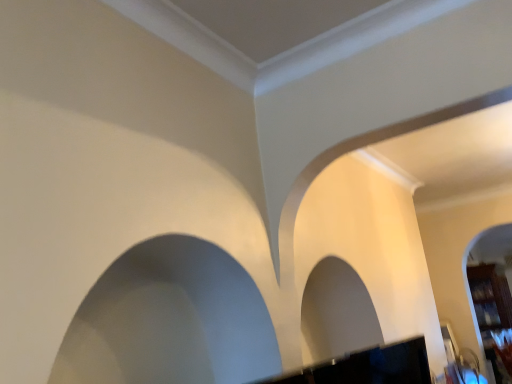
Locate an element on the screen. The height and width of the screenshot is (384, 512). white smooth rock arch at left is located at coordinates (170, 320).

Describe the element at coordinates (170, 320) in the screenshot. I see `white smooth rock arch at left` at that location.

Locate an element on the screen. wooden bookshelf at right is located at coordinates (490, 307).

This screenshot has height=384, width=512. What do you see at coordinates (490, 307) in the screenshot?
I see `wooden bookshelf at right` at bounding box center [490, 307].

In order to click on white smooth rock arch at left in this screenshot , I will do `click(170, 320)`.

Does wooden bookshelf at right appear on the left side of white smooth rock arch at left?

Incorrect, wooden bookshelf at right is not on the left side of white smooth rock arch at left.

Which is behind, wooden bookshelf at right or white smooth rock arch at left?

wooden bookshelf at right is further from the camera.

Which point is more distant from viewer, (492,347) or (163,235)?

The point (492,347) is farther.

From the image's perspective, is wooden bookshelf at right on white smooth rock arch at left?

Incorrect, from the image's perspective, wooden bookshelf at right is lower than white smooth rock arch at left.

From a real-world perspective, who is located higher, wooden bookshelf at right or white smooth rock arch at left?

From a 3D spatial view, white smooth rock arch at left is above.

From the picture: Which of these two, wooden bookshelf at right or white smooth rock arch at left, is wider?

wooden bookshelf at right is wider.

Is wooden bookshelf at right taller than white smooth rock arch at left?

Yes.

Can you confirm if wooden bookshelf at right is smaller than white smooth rock arch at left?

Actually, wooden bookshelf at right might be larger than white smooth rock arch at left.

Would you say wooden bookshelf at right is outside white smooth rock arch at left?

wooden bookshelf at right is positioned outside white smooth rock arch at left.

Looking at this image, are wooden bookshelf at right and white smooth rock arch at left far apart?

Yes, wooden bookshelf at right is far from white smooth rock arch at left.

Could you tell me if wooden bookshelf at right is facing white smooth rock arch at left?

No, wooden bookshelf at right does not turn towards white smooth rock arch at left.

How many degrees apart are the facing directions of wooden bookshelf at right and white smooth rock arch at left?

There is a 4.17-degree angle between the facing directions of wooden bookshelf at right and white smooth rock arch at left.

Measure the distance between wooden bookshelf at right and white smooth rock arch at left.

13.60 feet.

The image size is (512, 384). Find the location of `rock arch in front of the wooden bookshelf at right`. rock arch in front of the wooden bookshelf at right is located at coordinates (170, 320).

From the picture: Is white smooth rock arch at left at the left side of wooden bookshelf at right?

Correct, you'll find white smooth rock arch at left to the left of wooden bookshelf at right.

Which object is further away from the camera taking this photo, white smooth rock arch at left or wooden bookshelf at right?

wooden bookshelf at right is behind.

Does point (163, 339) lie in front of point (486, 288)?

Yes.

From the image's perspective, is white smooth rock arch at left above wooden bookshelf at right?

Yes, from the image's perspective, white smooth rock arch at left is on top of wooden bookshelf at right.

From a real-world perspective, who is located higher, white smooth rock arch at left or wooden bookshelf at right?

From a 3D spatial view, white smooth rock arch at left is above.

Does white smooth rock arch at left have a greater width compared to wooden bookshelf at right?

No, white smooth rock arch at left is not wider than wooden bookshelf at right.

Is white smooth rock arch at left taller than wooden bookshelf at right?

No.

Can you confirm if white smooth rock arch at left is smaller than wooden bookshelf at right?

Yes, white smooth rock arch at left is smaller than wooden bookshelf at right.

Is white smooth rock arch at left not inside wooden bookshelf at right?

Yes.

Would you consider white smooth rock arch at left to be distant from wooden bookshelf at right?

Indeed, white smooth rock arch at left is not near wooden bookshelf at right.

Is white smooth rock arch at left looking in the opposite direction of wooden bookshelf at right?

No, white smooth rock arch at left's orientation is not away from wooden bookshelf at right.

Can you tell me how much white smooth rock arch at left and wooden bookshelf at right differ in facing direction?

4.17 degrees.

Based on the photo, how much distance is there between white smooth rock arch at left and wooden bookshelf at right?

white smooth rock arch at left and wooden bookshelf at right are 4.15 meters apart from each other.

Where is `rock arch above the wooden bookshelf at right (from a real-world perspective)`? The image size is (512, 384). rock arch above the wooden bookshelf at right (from a real-world perspective) is located at coordinates click(x=170, y=320).

Where is `furniture that appears behind the white smooth rock arch at left`? The image size is (512, 384). furniture that appears behind the white smooth rock arch at left is located at coordinates (490, 307).

This screenshot has height=384, width=512. There is a wooden bookshelf at right. In order to click on rock arch above it (from a real-world perspective) in this screenshot , I will do `click(170, 320)`.